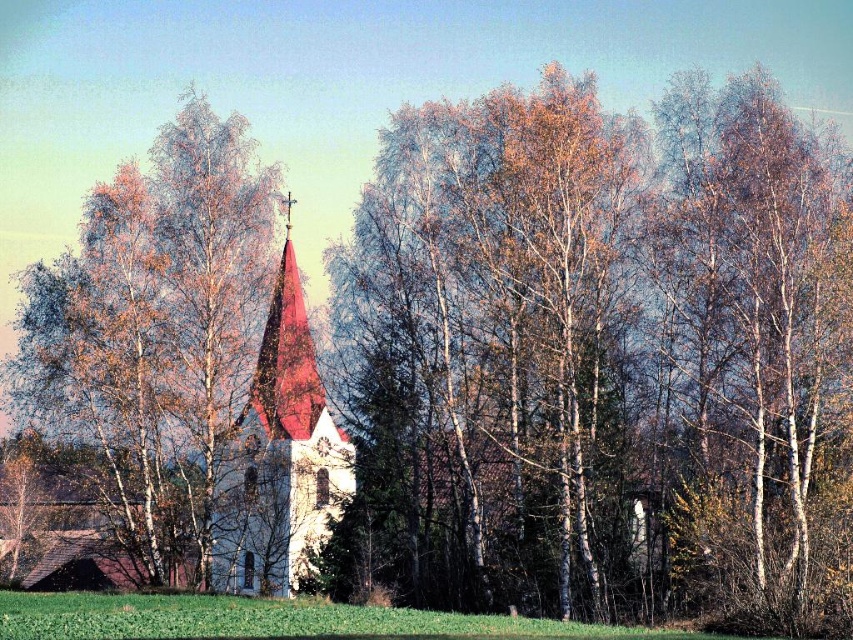
Question: Which object appears farthest from the camera in this image?

Choices:
 (A) green grassy field at lower center
 (B) smooth white bark at center
 (C) smooth red steeple at center

Answer: (C)

Question: Which point is farther from the camera taking this photo?

Choices:
 (A) (637, 198)
 (B) (244, 481)
 (C) (27, 595)
 (D) (216, 476)

Answer: (B)

Question: Does smooth white bark at center appear on the right side of smooth red steeple at center?

Choices:
 (A) yes
 (B) no

Answer: (A)

Question: Can you confirm if smooth red steeple at center is bigger than green grassy field at lower center?

Choices:
 (A) no
 (B) yes

Answer: (B)

Question: Does smooth white bark at center appear on the right side of smooth red steeple at center?

Choices:
 (A) yes
 (B) no

Answer: (A)

Question: Which point appears farthest from the camera in this image?

Choices:
 (A) (28, 637)
 (B) (225, 584)

Answer: (B)